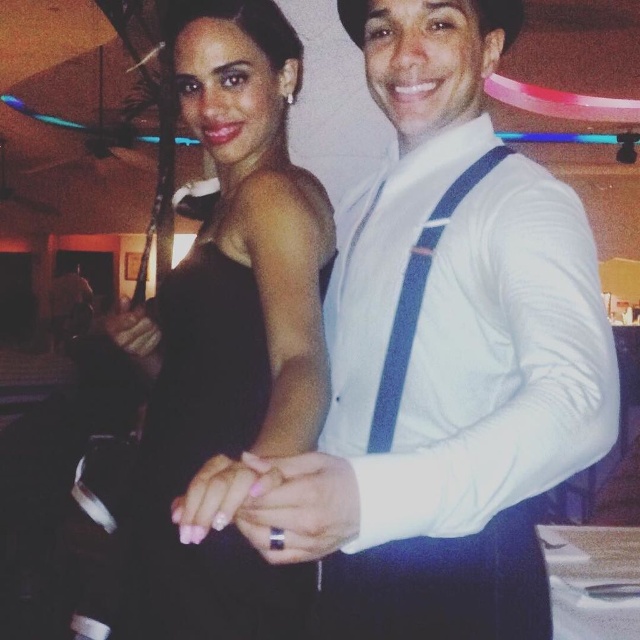
How far apart are white satin shirt at center and black satin dress at center?

They are 7.77 inches apart.

Does white satin shirt at center appear on the right side of black satin dress at center?

Yes, white satin shirt at center is to the right of black satin dress at center.

Between point (518, 324) and point (188, 3), which one is positioned behind?

The point (188, 3) is more distant.

Locate an element on the screen. The image size is (640, 640). white satin shirt at center is located at coordinates (444, 356).